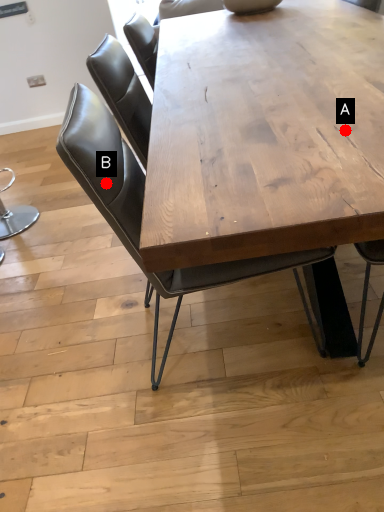
Question: Two points are circled on the image, labeled by A and B beside each circle. Among these points, which one is farthest from the camera?

Choices:
 (A) A is further
 (B) B is further

Answer: (B)